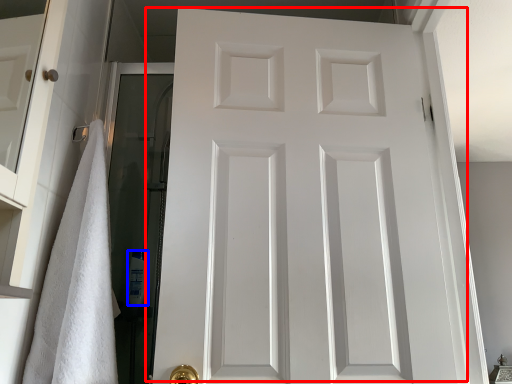
Question: Which object is further to the camera taking this photo, door (highlighted by a red box) or toiletry (highlighted by a blue box)?

Choices:
 (A) door
 (B) toiletry

Answer: (B)